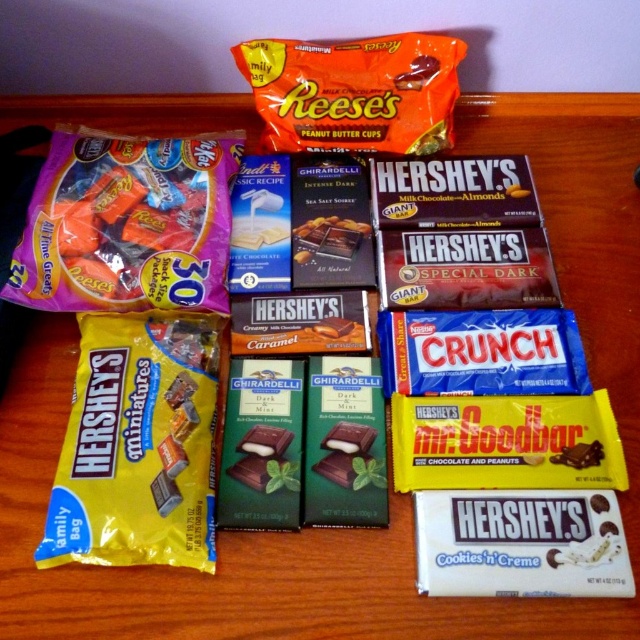
Question: Can you confirm if yellow matte hershey's miniatures at lower left is positioned below matte plastic bag of assorted candies at upper left?

Choices:
 (A) yes
 (B) no

Answer: (A)

Question: Estimate the real-world distances between objects in this image. Which object is farther from the green matte ghirardelli chocolate bar at center?

Choices:
 (A) yellow matte hershey's miniatures at lower left
 (B) matte plastic bag of assorted candies at upper left
 (C) dark chocolate bar at center

Answer: (B)

Question: In this image, where is dark chocolate bar at center located relative to green matte ghirardelli chocolate bar at center?

Choices:
 (A) below
 (B) above

Answer: (A)

Question: Which object appears farthest from the camera in this image?

Choices:
 (A) orange matte reese's peanut butter cups at upper center
 (B) green matte ghirardelli chocolate bar at center

Answer: (A)

Question: Which of the following is the closest to the observer?

Choices:
 (A) matte plastic bag of assorted candies at upper left
 (B) orange matte reese's peanut butter cups at upper center
 (C) yellow matte hershey's miniatures at lower left

Answer: (C)

Question: Is matte plastic bag of assorted candies at upper left wider than green matte ghirardelli chocolate bar at center?

Choices:
 (A) no
 (B) yes

Answer: (B)